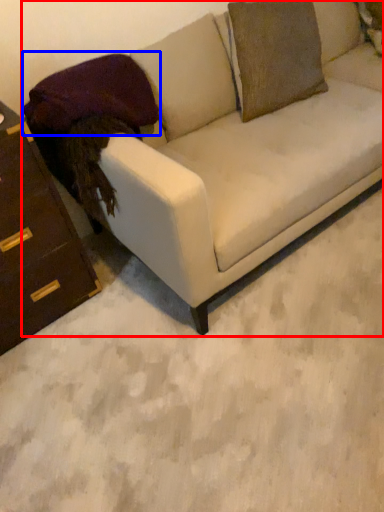
Question: Which of the following is the closest to the observer, studio couch (highlighted by a red box) or pillow (highlighted by a blue box)?

Choices:
 (A) studio couch
 (B) pillow

Answer: (A)